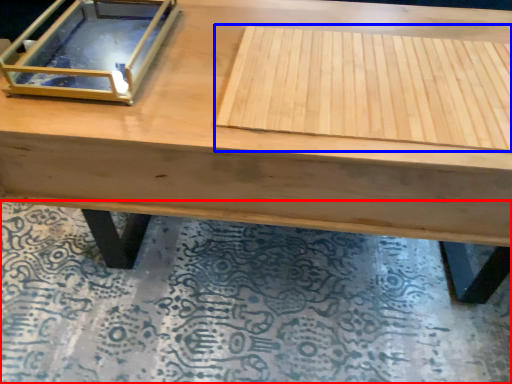
Question: Which object is further to the camera taking this photo, mat (highlighted by a red box) or plywood (highlighted by a blue box)?

Choices:
 (A) mat
 (B) plywood

Answer: (A)